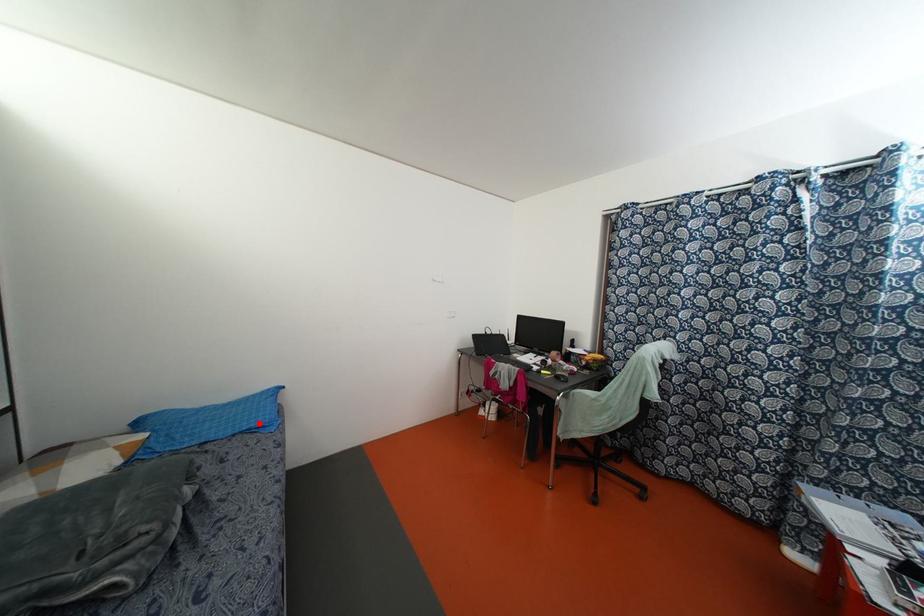
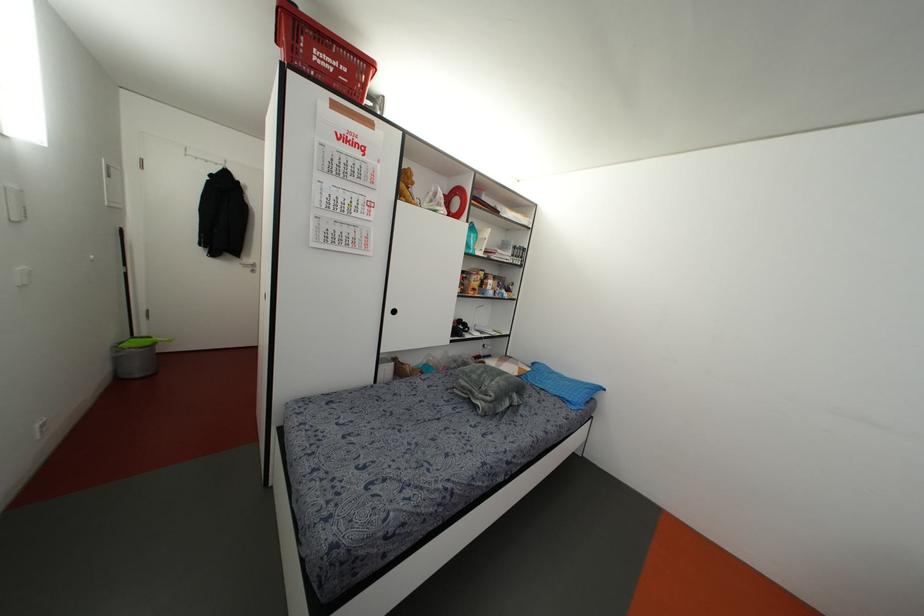
Question: A red point is marked in image1. In image2, is the corresponding 3D point closer to the camera or farther? Reply with the corresponding letter.

Choices:
 (A) The corresponding 3D point is closer.
 (B) The corresponding 3D point is farther.

Answer: (B)